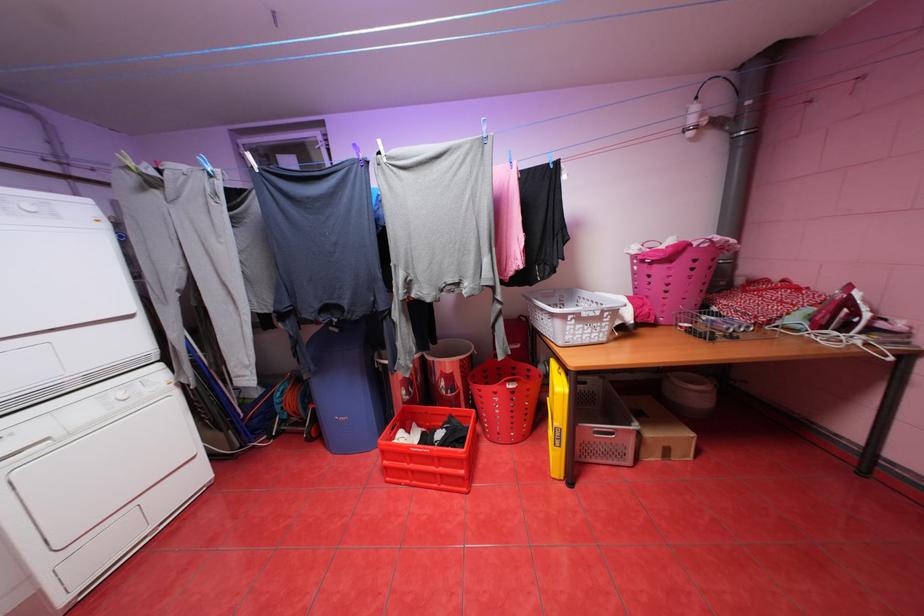
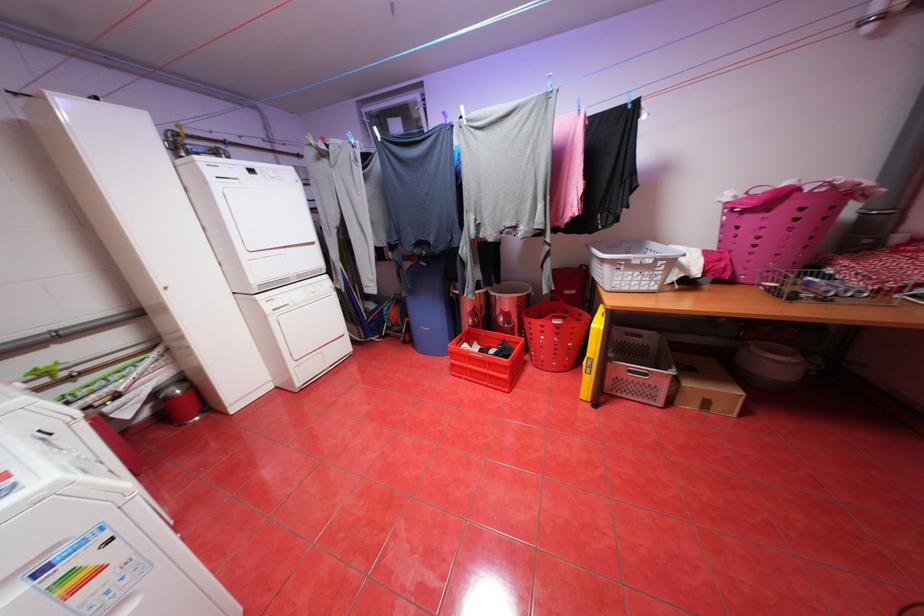
The point at (345, 330) is marked in the first image. Where is the corresponding point in the second image?

(433, 264)